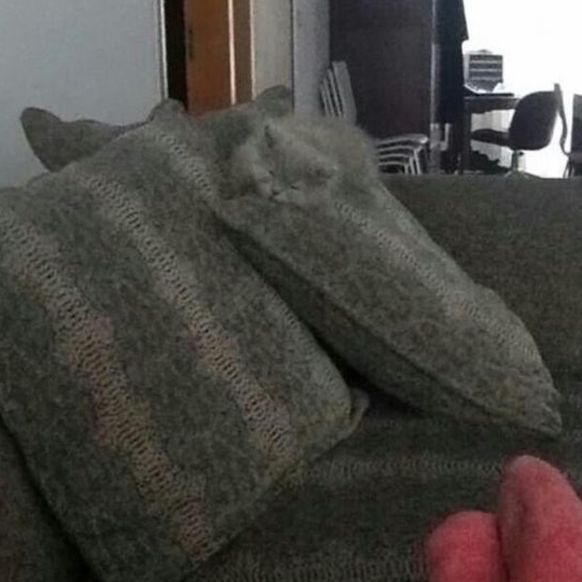
Where is `office chair`? office chair is located at coordinates (523, 136).